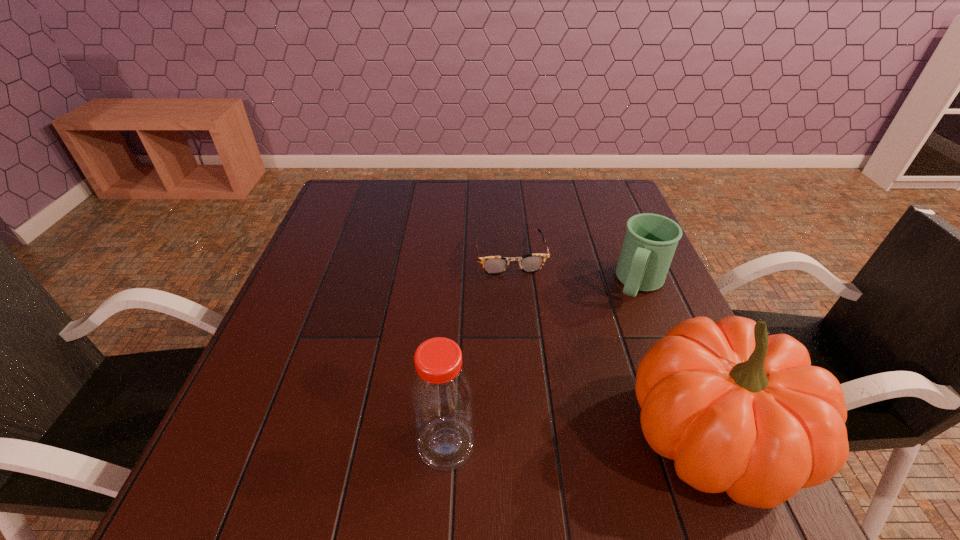
The width and height of the screenshot is (960, 540). Identify the location of free space at the right edge. (660, 305).

In the image, there is a desktop. Where is `vacant space at the far left corner`? The width and height of the screenshot is (960, 540). vacant space at the far left corner is located at coordinates (374, 192).

Where is `vacant space at the far right corner of the desktop`? The image size is (960, 540). vacant space at the far right corner of the desktop is located at coordinates point(613,200).

The width and height of the screenshot is (960, 540). I want to click on vacant region between the shortest object and the second shortest object, so click(x=575, y=270).

Locate an element on the screen. free spot between the bottle and the pumpkin is located at coordinates (580, 441).

Where is `free space that is in between the bottle and the pumpkin`? free space that is in between the bottle and the pumpkin is located at coordinates (580, 441).

I want to click on empty location between the bottle and the shortest object, so click(478, 350).

Identify the location of unoccupied area between the shortest object and the mug. The width and height of the screenshot is (960, 540). (575, 270).

The width and height of the screenshot is (960, 540). Find the location of `free spot between the second shortest object and the spectacles`. free spot between the second shortest object and the spectacles is located at coordinates (575, 270).

Identify the location of vacant space that's between the bottle and the pumpkin. (580, 441).